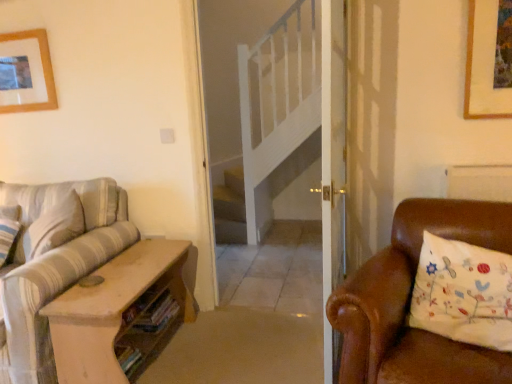
Question: Is white embroidered pillow at right next to striped fabric couch at left?

Choices:
 (A) no
 (B) yes

Answer: (A)

Question: Is white embroidered pillow at right facing towards striped fabric couch at left?

Choices:
 (A) yes
 (B) no

Answer: (B)

Question: From the image's perspective, would you say white embroidered pillow at right is shown under striped fabric couch at left?

Choices:
 (A) no
 (B) yes

Answer: (A)

Question: Can you confirm if white embroidered pillow at right is positioned to the left of striped fabric couch at left?

Choices:
 (A) no
 (B) yes

Answer: (A)

Question: Is striped fabric couch at left inside white embroidered pillow at right?

Choices:
 (A) no
 (B) yes

Answer: (A)

Question: From a real-world perspective, is white embroidered pillow at right under striped fabric couch at left?

Choices:
 (A) yes
 (B) no

Answer: (B)

Question: Would you say white embroidered pillow at right is a long distance from wooden picture frame at upper left?

Choices:
 (A) yes
 (B) no

Answer: (A)

Question: Is white embroidered pillow at right positioned behind wooden picture frame at upper left?

Choices:
 (A) no
 (B) yes

Answer: (A)

Question: Is white embroidered pillow at right looking in the opposite direction of wooden picture frame at upper left?

Choices:
 (A) yes
 (B) no

Answer: (B)

Question: From the image's perspective, does white embroidered pillow at right appear lower than wooden picture frame at upper left?

Choices:
 (A) no
 (B) yes

Answer: (B)

Question: Can you confirm if white embroidered pillow at right is smaller than wooden picture frame at upper left?

Choices:
 (A) yes
 (B) no

Answer: (B)

Question: Can we say white embroidered pillow at right lies outside wooden picture frame at upper left?

Choices:
 (A) no
 (B) yes

Answer: (B)

Question: From the image's perspective, would you say striped fabric couch at left is shown under wooden picture frame at upper left?

Choices:
 (A) yes
 (B) no

Answer: (A)